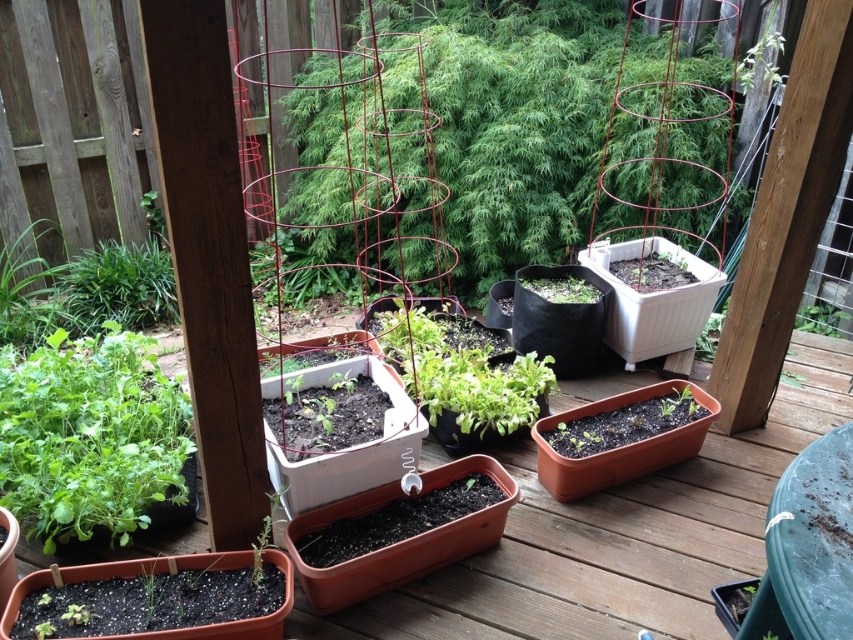
Question: Observing the image, what is the correct spatial positioning of green matte plant at center in reference to green leafy plant at lower right?

Choices:
 (A) left
 (B) right

Answer: (A)

Question: Which object is positioned closest to the green matte plant at center?

Choices:
 (A) green leafy plant at lower left
 (B) green leafy plant at lower right

Answer: (B)

Question: Which point is farther to the camera?

Choices:
 (A) green matte plant at lower left
 (B) green leafy plant at lower left

Answer: (B)

Question: Which of the following is the closest to the observer?

Choices:
 (A) (833, 305)
 (B) (264, 518)

Answer: (B)

Question: Does green leafy plant at lower left appear under green leafy plant at lower right?

Choices:
 (A) no
 (B) yes

Answer: (B)

Question: Is green matte plant at center smaller than green leafy plant at lower right?

Choices:
 (A) no
 (B) yes

Answer: (A)